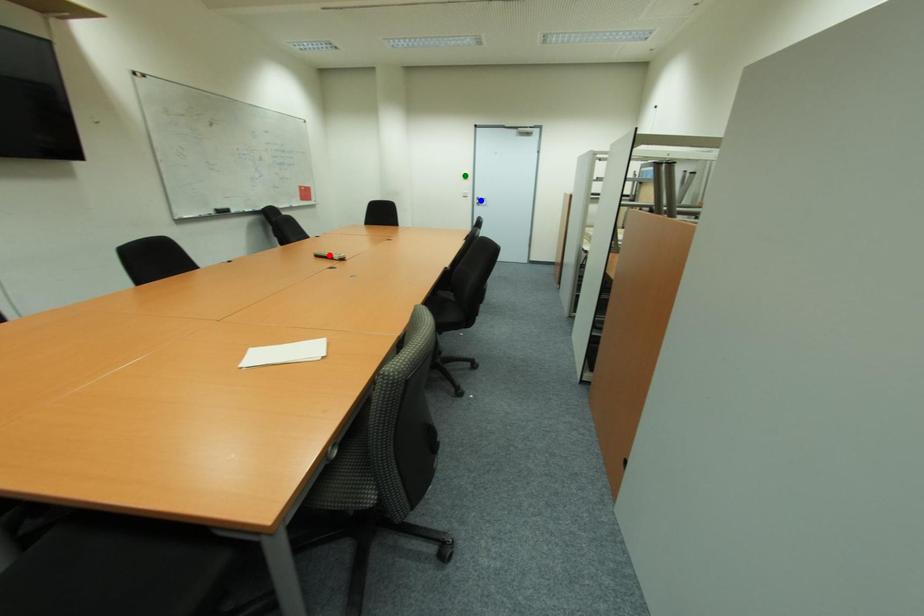
Order these from nearest to farthest:
red point, green point, blue point

red point → blue point → green point